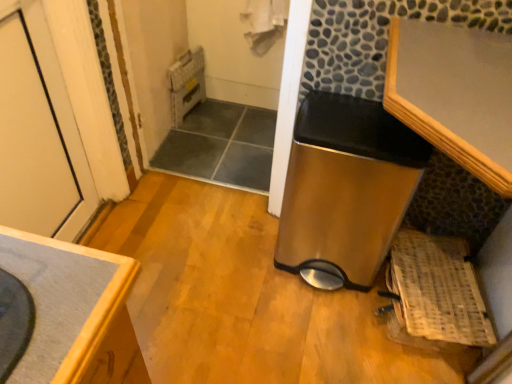
Identify the location of free space in front of stainless steel trash can at center, arranged as the 2th water heater when viewed from the top. (310, 331).